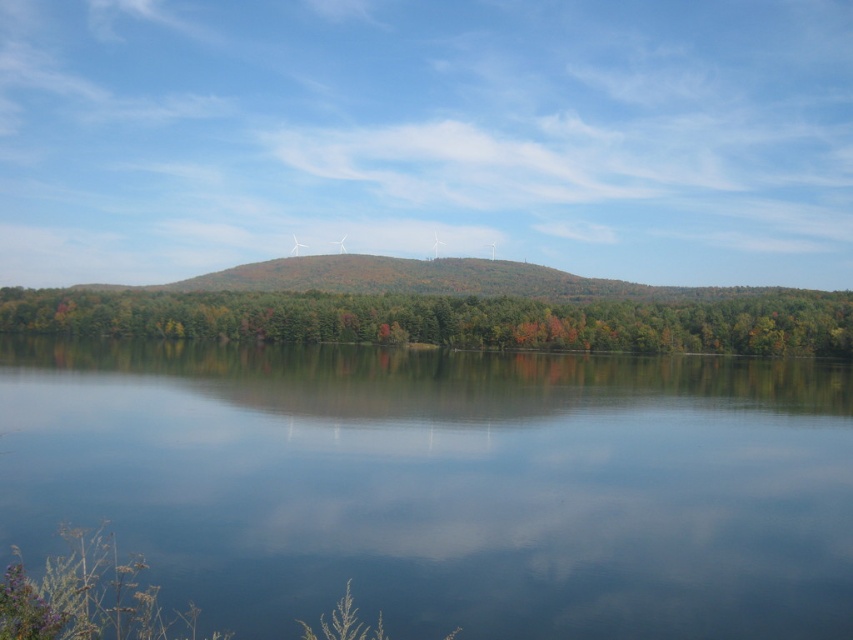
Locate an element on the screen. transparent water at center is located at coordinates (444, 484).

Between transparent water at center and green matte tree at center, which one appears on the right side from the viewer's perspective?

From the viewer's perspective, transparent water at center appears more on the right side.

Who is more forward, (206, 564) or (370, 340)?

Positioned in front is point (206, 564).

The image size is (853, 640). Identify the location of transparent water at center. (444, 484).